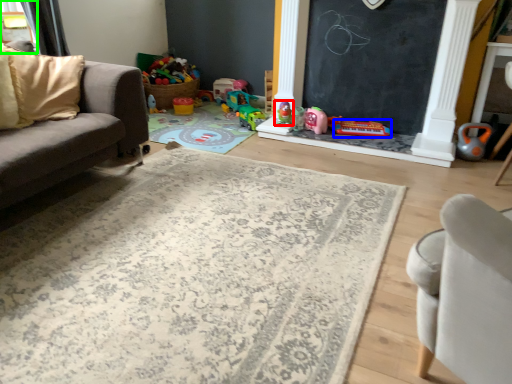
Question: Which is farther away from toy (highlighted by a red box)? toy (highlighted by a blue box) or window (highlighted by a green box)?

Choices:
 (A) toy
 (B) window

Answer: (B)